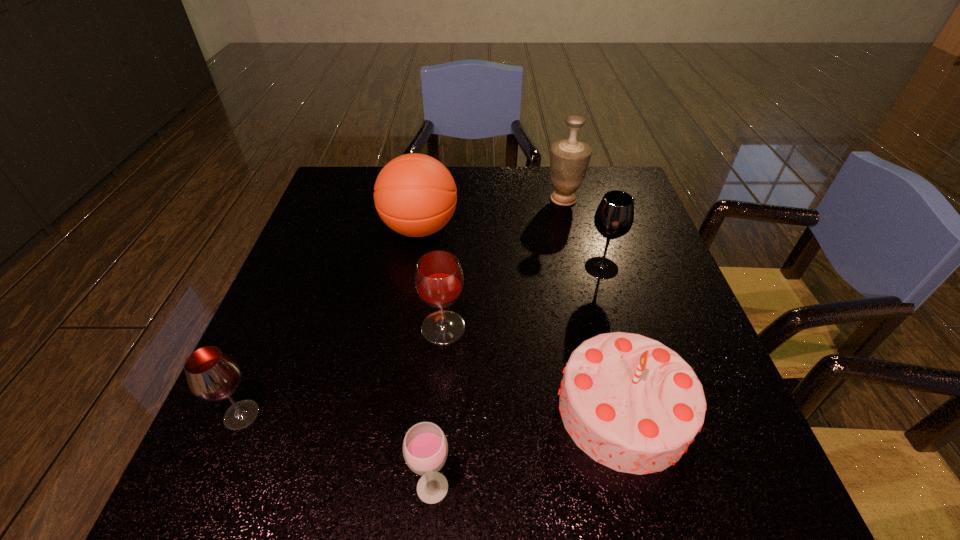
You are a GUI agent. You are given a task and a screenshot of the screen. Output one action in this format:
    pyautogui.click(x=<x>, y=<y>)
    Task: Click on the blank region between the leftmost object and the birthday cake
    
    Given the screenshot: What is the action you would take?
    pyautogui.click(x=433, y=413)

Point out which object is positioned as the third nearest to the fourth farthest object. Please provide its 2D coordinates. Your answer should be formatted as a tuple, i.e. [(x, y)], where the tuple contains the x and y coordinates of a point satisfying the conditions above.

[(425, 448)]

Identify which object is located as the fourth nearest to the third farthest wineglass. Please provide its 2D coordinates. Your answer should be formatted as a tuple, i.e. [(x, y)], where the tuple contains the x and y coordinates of a point satisfying the conditions above.

[(631, 403)]

Choose which wineglass is the fourth nearest neighbor to the urn. Please provide its 2D coordinates. Your answer should be formatted as a tuple, i.e. [(x, y)], where the tuple contains the x and y coordinates of a point satisfying the conditions above.

[(212, 375)]

Locate an element on the screen. The width and height of the screenshot is (960, 540). wineglass identified as the third closest to the urn is located at coordinates (425, 448).

This screenshot has height=540, width=960. Find the location of `free location that satisfies the following two spatial constraints: 1. on the back side of the second farthest wineglass; 2. on the left side of the urn`. free location that satisfies the following two spatial constraints: 1. on the back side of the second farthest wineglass; 2. on the left side of the urn is located at coordinates (453, 199).

The image size is (960, 540). Find the location of `blank area in the image that satisfies the following two spatial constraints: 1. on the back side of the urn; 2. on the right side of the leftmost wineglass`. blank area in the image that satisfies the following two spatial constraints: 1. on the back side of the urn; 2. on the right side of the leftmost wineglass is located at coordinates (333, 199).

Locate an element on the screen. blank space that satisfies the following two spatial constraints: 1. on the front side of the birthday cake; 2. on the left side of the third nearest wineglass is located at coordinates (437, 410).